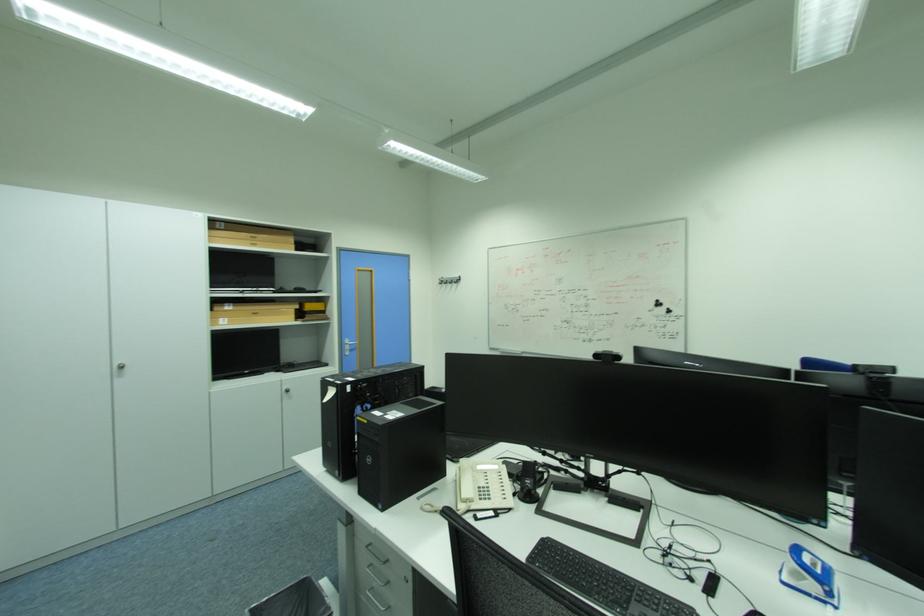
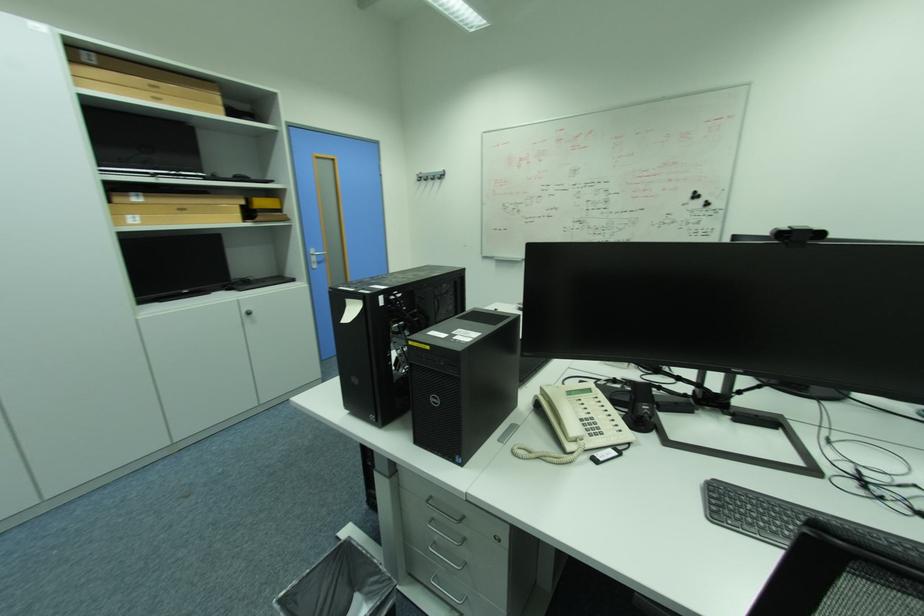
Where in the second image is the point corresponding to (x=375, y=546) from the first image?

(435, 501)